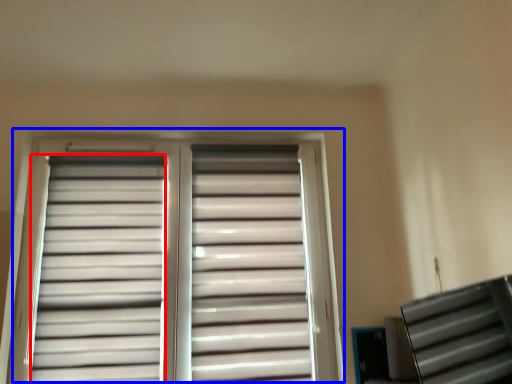
Question: Which object is closer to the camera taking this photo, shutter (highlighted by a red box) or window (highlighted by a blue box)?

Choices:
 (A) shutter
 (B) window

Answer: (A)